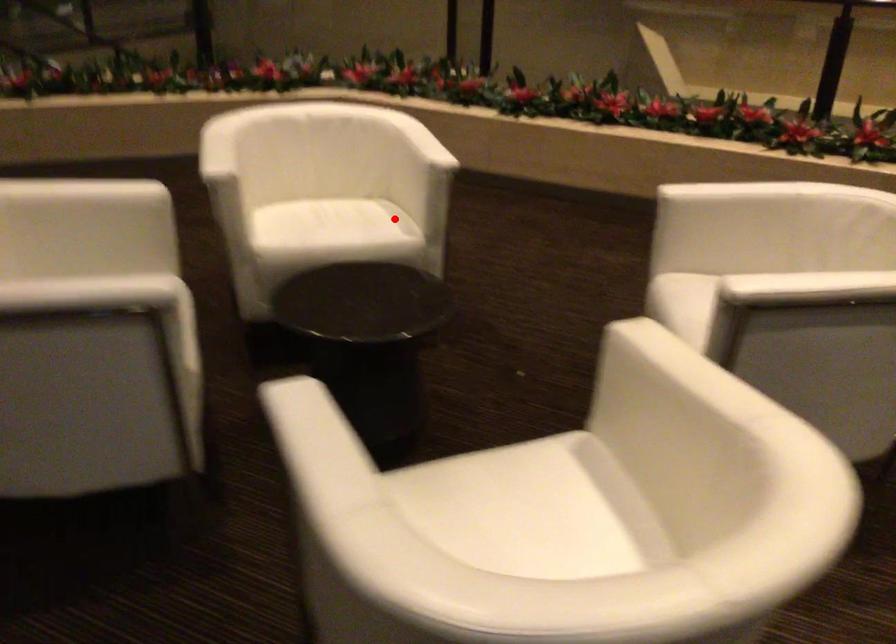
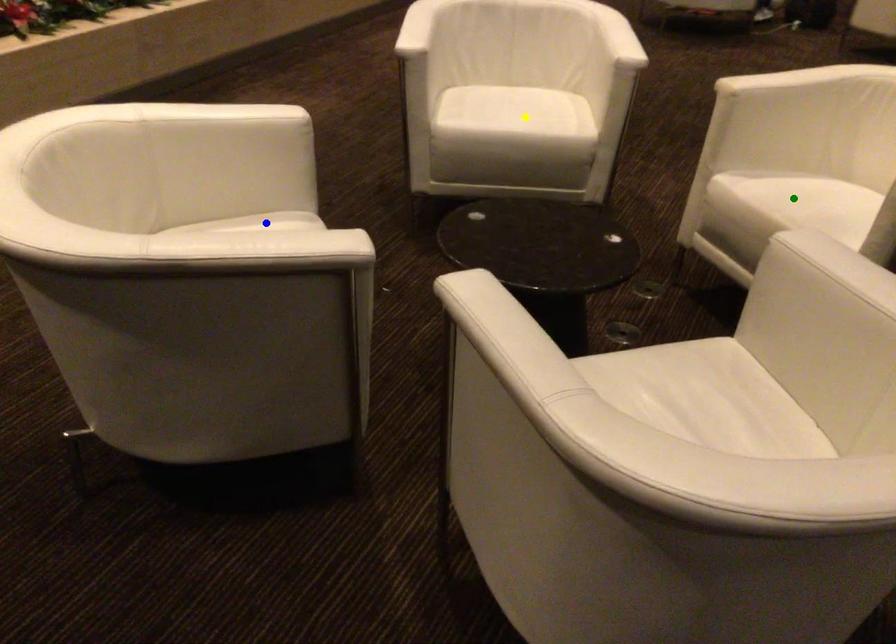
Question: I am providing you with two images of the same scene from different viewpoints. A red point is marked on the first image. You are given multiple points on the second image. Which spot in image 2 lines up with the point in image 1?

Choices:
 (A) yellow point
 (B) blue point
 (C) green point

Answer: (B)